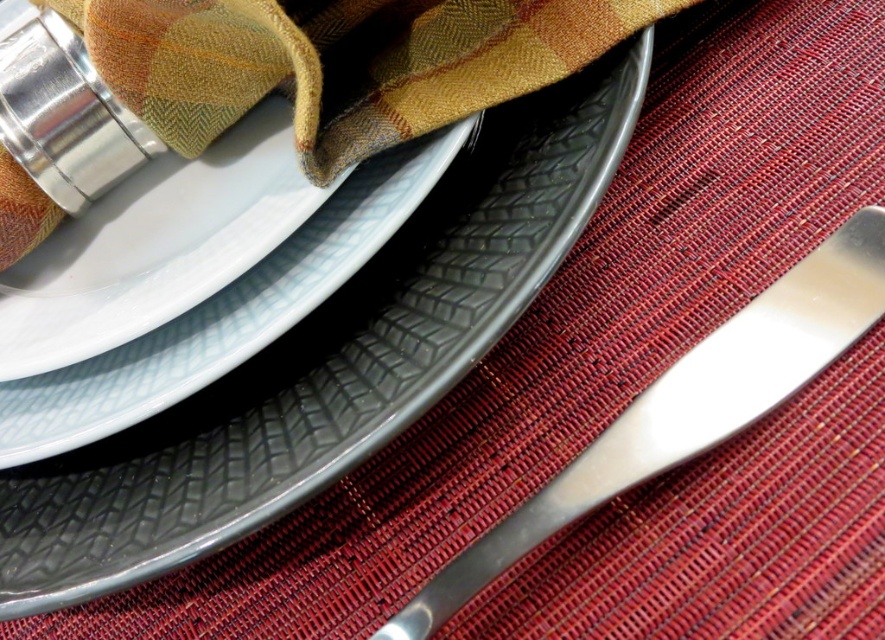
Question: Is matte gray platter at center further to the viewer compared to matte gray plate at center?

Choices:
 (A) no
 (B) yes

Answer: (A)

Question: Which is nearer to the polished metal butter knife at lower right?

Choices:
 (A) matte gray plate at center
 (B) matte gray platter at center

Answer: (B)

Question: Which object is the closest to the polished metal butter knife at lower right?

Choices:
 (A) matte gray platter at center
 (B) matte gray plate at center

Answer: (A)

Question: Can you confirm if matte gray platter at center is positioned below polished metal butter knife at lower right?

Choices:
 (A) no
 (B) yes

Answer: (A)

Question: Based on their relative distances, which object is nearer to the matte gray plate at center?

Choices:
 (A) polished metal butter knife at lower right
 (B) matte gray platter at center

Answer: (B)

Question: Can you confirm if matte gray platter at center is thinner than polished metal butter knife at lower right?

Choices:
 (A) yes
 (B) no

Answer: (B)